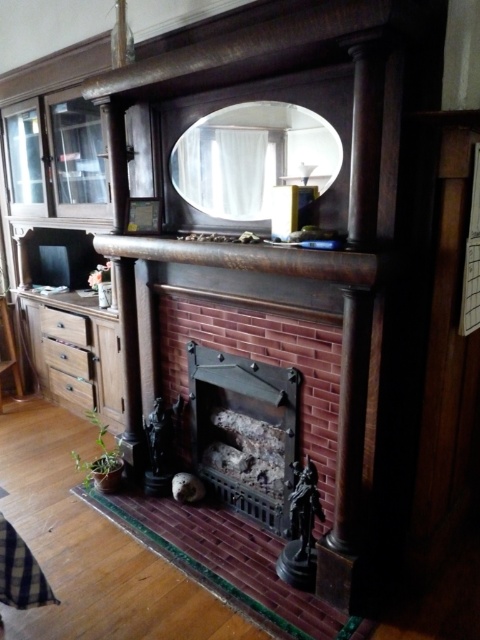
You are an interior designer planning to move a small plant to the space between the matte glass mirror at upper center and the matte brown drawer at lower left. Based on their positions, which side of the mirror should you place the plant to ensure it is between them?

The matte glass mirror at upper center is to the right of the matte brown drawer at lower left, so placing the plant to the left side of the mirror would position it between them.

You are standing in front of the fireplace and want to know the distance to a specific point in the scene. The point is labeled as point (228,161). Can you tell me how far this point is from your current position?

The point (228,161) is 2.37 meters away from the camera, so the distance from your current position to that point is 2.37 meters.